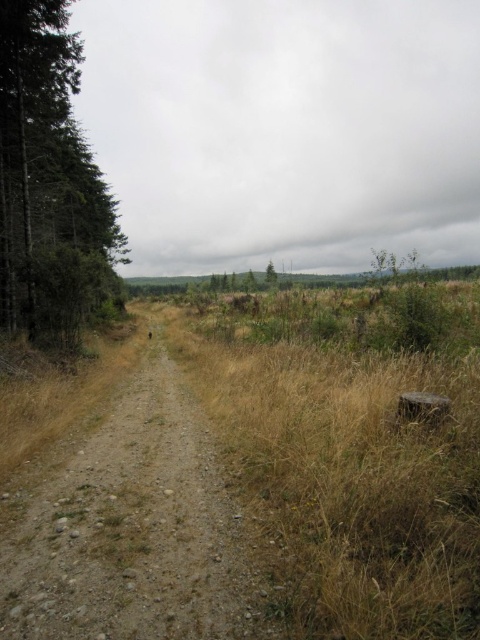
You are a hiker standing at the dry grass at center and want to reach the dark green textured tree at left. Given that your average walking pace is 3 feet per second, how many seconds will it take you to reach the tree if you walk directly towards it?

The dry grass at center is 144.32 feet from the dark green textured tree at left. At a pace of 3 feet per second, it would take approximately 48.1 seconds to reach the tree.

You are standing at the point marked as point [131,529] in the image. What is the terrain like at your current location?

The terrain at point [131,529] is a dirt gravel trail at center.